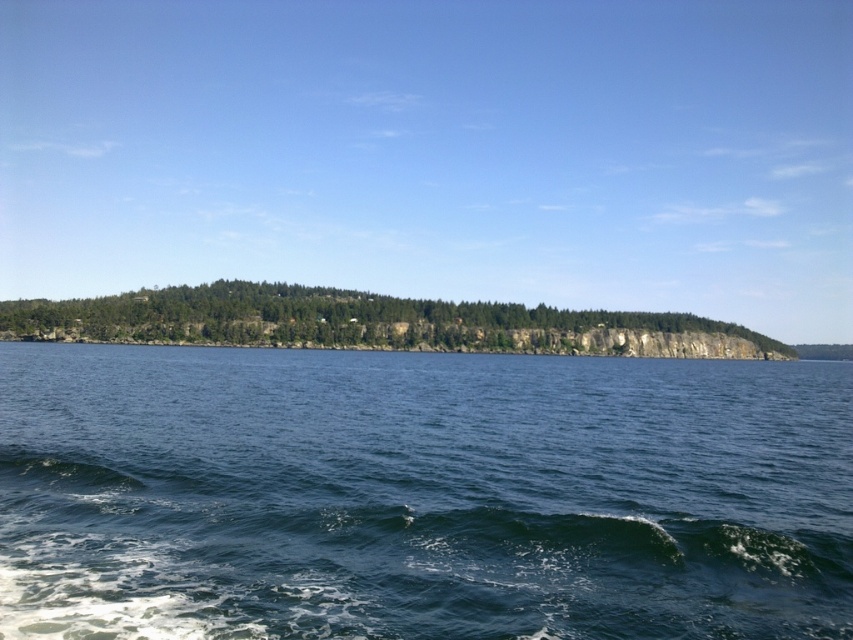
Is the position of dark blue water at center less distant than that of green leafy trees at center?

Yes, it is in front of green leafy trees at center.

Is point (413, 368) closer to camera compared to point (711, 346)?

Yes, point (413, 368) is in front of point (711, 346).

The width and height of the screenshot is (853, 640). Describe the element at coordinates (421, 496) in the screenshot. I see `dark blue water at center` at that location.

The width and height of the screenshot is (853, 640). I want to click on dark blue water at center, so click(x=421, y=496).